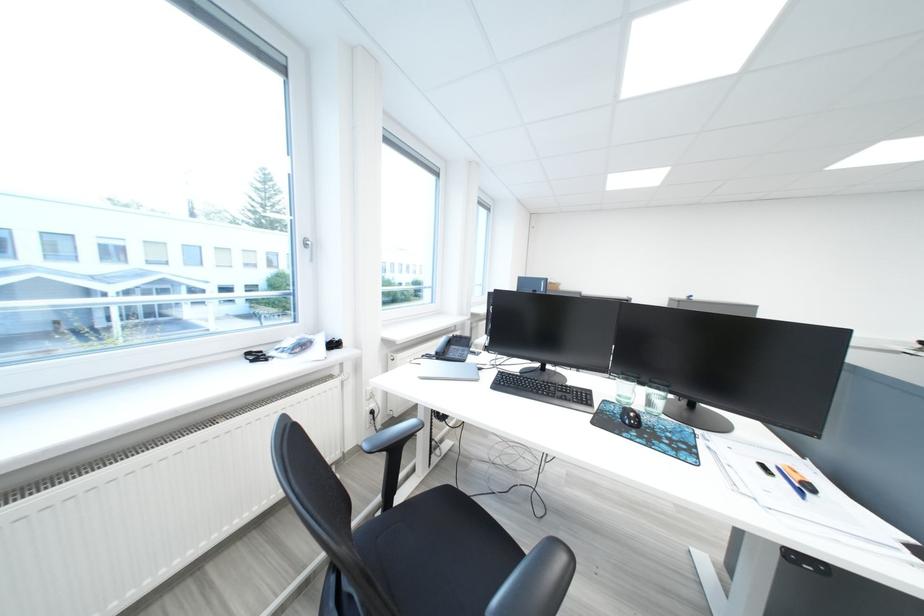
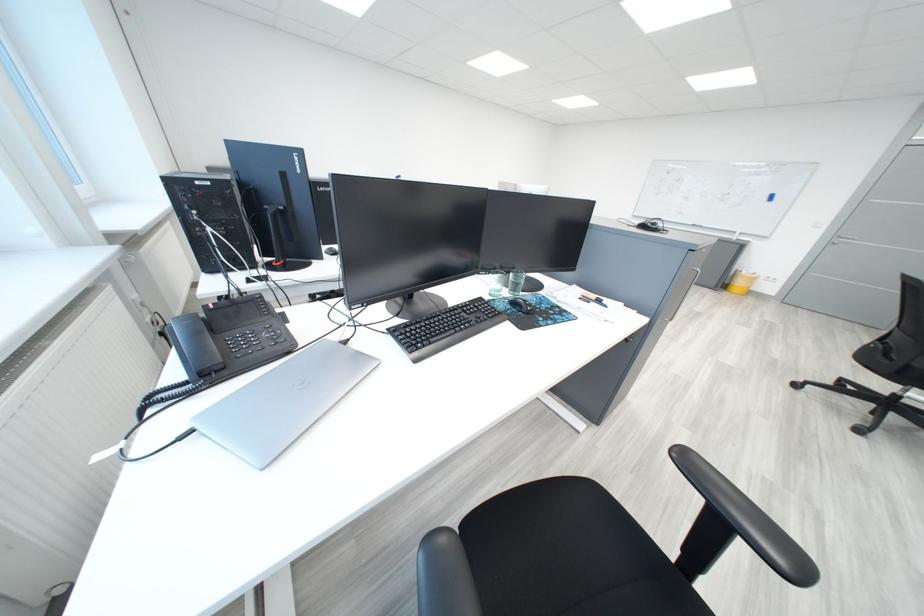
First-person continuous shooting, in which direction is the camera rotating?

The camera rotated toward right-down.